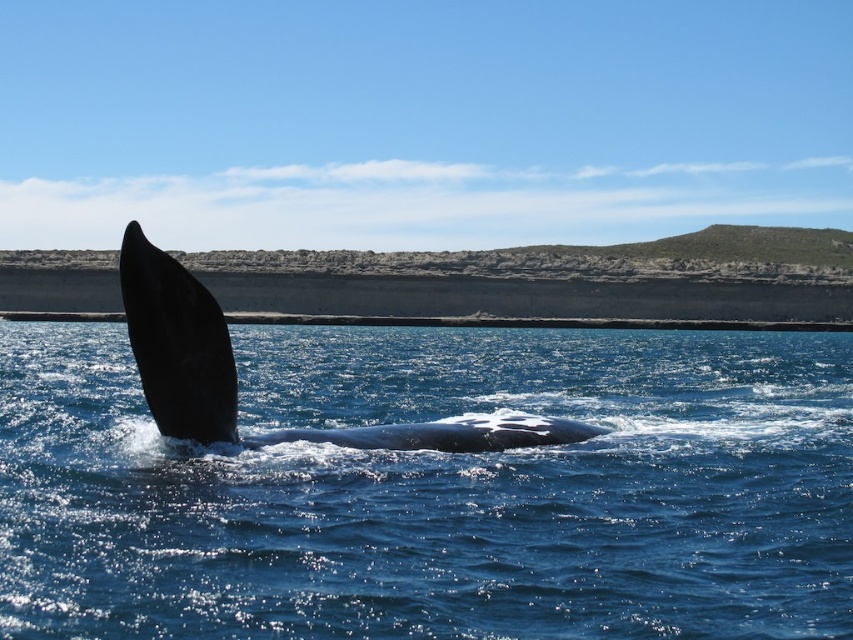
Does blue water at center have a lesser height compared to black smooth whale at left?

Yes, blue water at center is shorter than black smooth whale at left.

Which of these two, blue water at center or black smooth whale at left, stands shorter?

blue water at center

Find the location of a particular element. The image size is (853, 640). blue water at center is located at coordinates (433, 490).

Can you confirm if smooth dark gray whale at center is bigger than black smooth whale at left?

Yes.

Who is positioned more to the left, smooth dark gray whale at center or black smooth whale at left?

From the viewer's perspective, black smooth whale at left appears more on the left side.

Who is more forward, (409, 422) or (198, 435)?

Point (198, 435) is more forward.

Identify the location of smooth dark gray whale at center. The width and height of the screenshot is (853, 640). (236, 378).

Is blue water at center bigger than smooth dark gray whale at center?

Yes.

Which is above, blue water at center or smooth dark gray whale at center?

smooth dark gray whale at center

Identify the location of blue water at center. This screenshot has height=640, width=853. (433, 490).